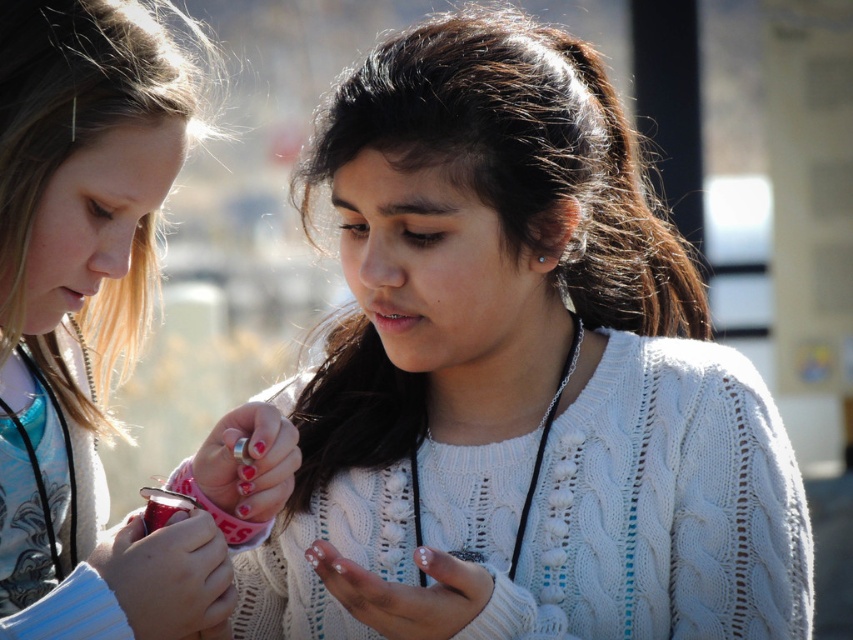
Can you confirm if white knitted sweater at center is smaller than matte white sweater at center?

Actually, white knitted sweater at center might be larger than matte white sweater at center.

This screenshot has width=853, height=640. Describe the element at coordinates (518, 378) in the screenshot. I see `white knitted sweater at center` at that location.

The width and height of the screenshot is (853, 640). In order to click on white knitted sweater at center in this screenshot , I will do `click(518, 378)`.